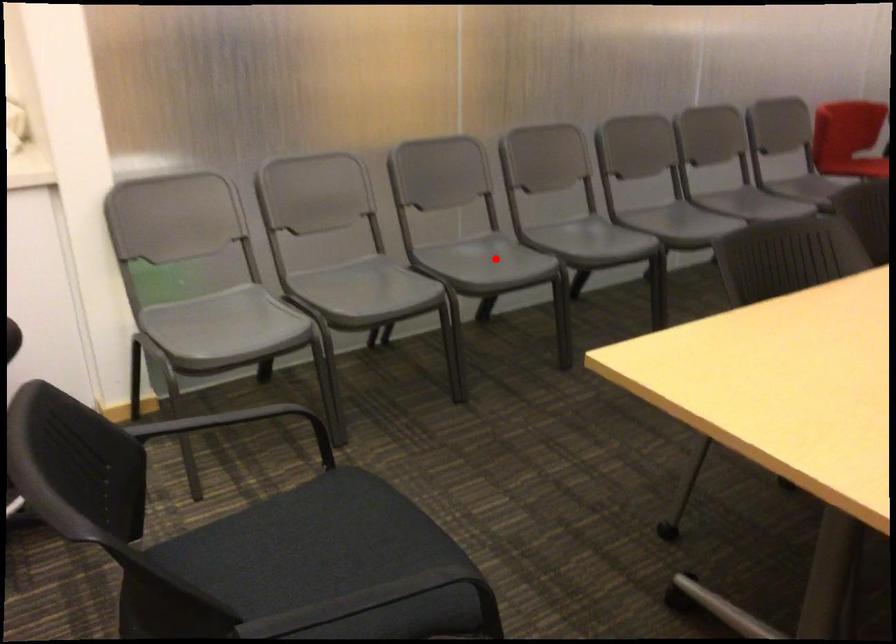
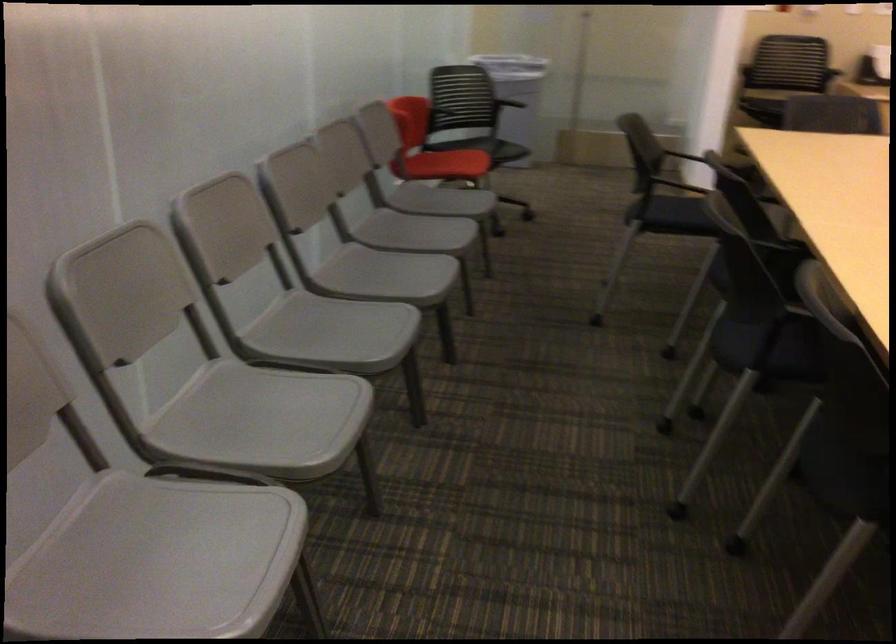
Question: I am providing you with two images of the same scene from different viewpoints. Image1 has a red point marked. In image2, the corresponding 3D location appears at what relative position? Reply with the corresponding letter.

Choices:
 (A) Closer
 (B) Farther

Answer: (A)